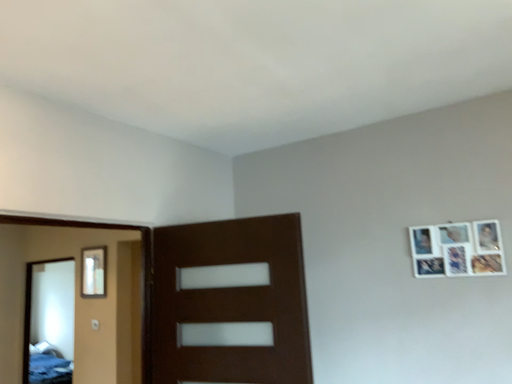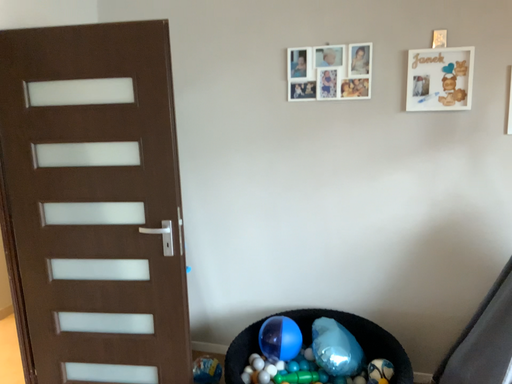
Question: Which way did the camera rotate in the video?

Choices:
 (A) rotated upward
 (B) rotated downward

Answer: (B)